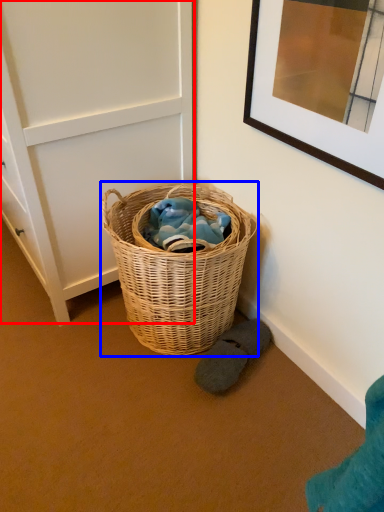
Question: Which point is closer to the camera, door (highlighted by a red box) or picnic basket (highlighted by a blue box)?

Choices:
 (A) door
 (B) picnic basket

Answer: (A)